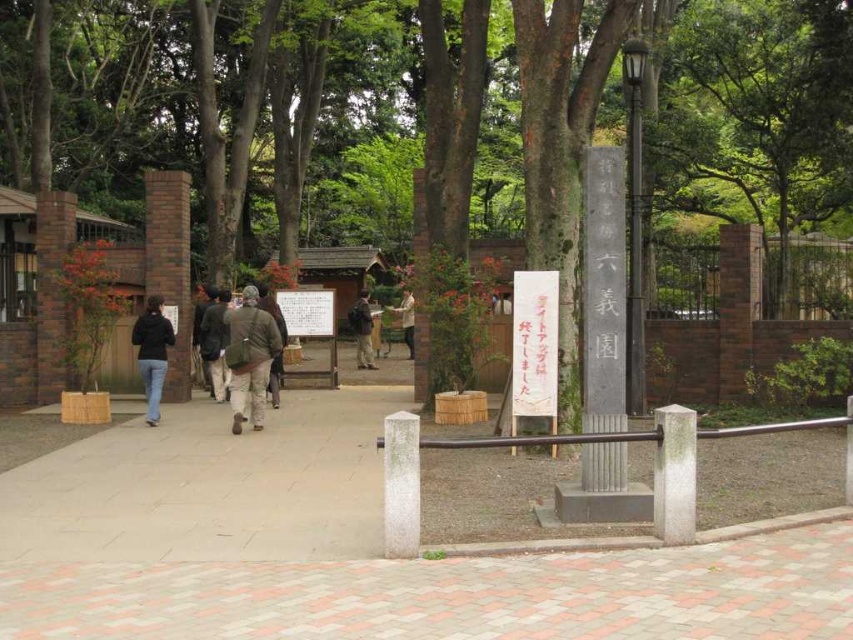
Is brick wall at left in front of khaki cotton jacket at center?

No, brick wall at left is behind khaki cotton jacket at center.

Which is in front, point (181, 257) or point (409, 289)?

Positioned in front is point (409, 289).

I want to click on brick wall at left, so click(170, 264).

In the scene shown: Is green leafy tree at center taller than khaki cotton jacket at center?

Yes, green leafy tree at center is taller than khaki cotton jacket at center.

Measure the distance between green leafy tree at center and camera.

The distance of green leafy tree at center from camera is 9.00 meters.

What do you see at coordinates (756, 108) in the screenshot? Image resolution: width=853 pixels, height=640 pixels. I see `green leafy tree at center` at bounding box center [756, 108].

Locate an element on the screen. Image resolution: width=853 pixels, height=640 pixels. green leafy tree at center is located at coordinates (756, 108).

This screenshot has height=640, width=853. What do you see at coordinates (280, 340) in the screenshot?
I see `brown woolen jacket at center` at bounding box center [280, 340].

Identify the location of brown woolen jacket at center. The width and height of the screenshot is (853, 640). [x=280, y=340].

I want to click on brown woolen jacket at center, so click(x=280, y=340).